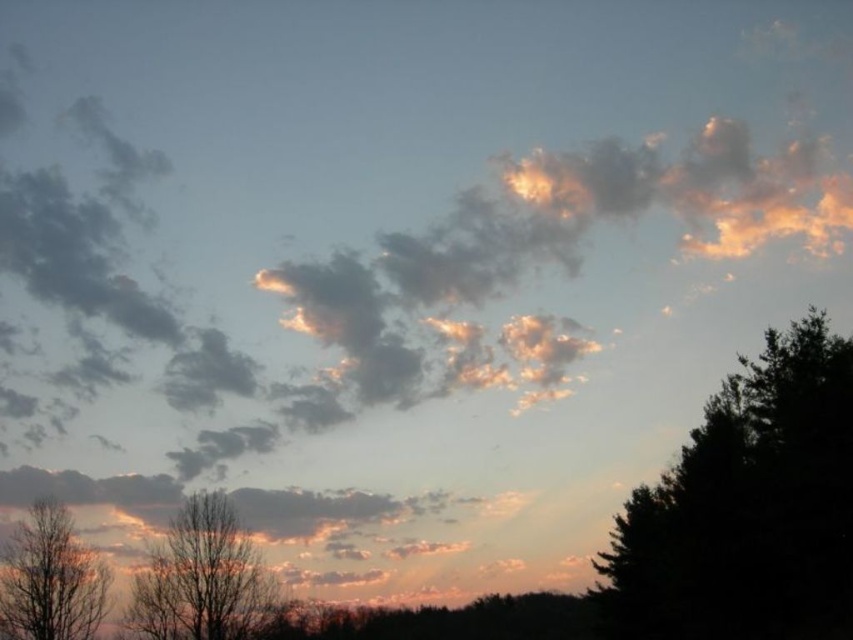
From the picture: You are an artist sketching the sunset scene. You notice two trees at the lower left corner. Which tree has a wider trunk? The silvery bark tree at lower left or the bare wood tree at lower left?

The silvery bark tree at lower left has a wider trunk than the bare wood tree at lower left according to the description.

You are an artist planning to paint the sunset scene. You want to ensure the silvery bark tree at lower left and the bare wood tree at lower left are proportionally accurate. Which tree should you depict as taller in your painting?

The silvery bark tree at lower left should be depicted as taller in the painting because it has a greater height compared to the bare wood tree at lower left according to the description.

You are an artist planning to paint this sunset scene. You want to ensure the dark green leafy tree at right and the bare wood tree at lower left are proportionally accurate. Which tree should you draw wider in your painting?

The dark green leafy tree at right should be drawn wider since its width is larger than the bare wood tree at lower left.